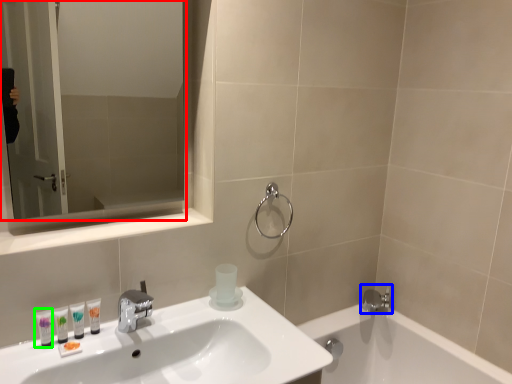
Question: Which object is positioned farthest from mirror (highlighted by a red box)? Select from tap (highlighted by a blue box) and mouthwash (highlighted by a green box).

Choices:
 (A) tap
 (B) mouthwash

Answer: (A)